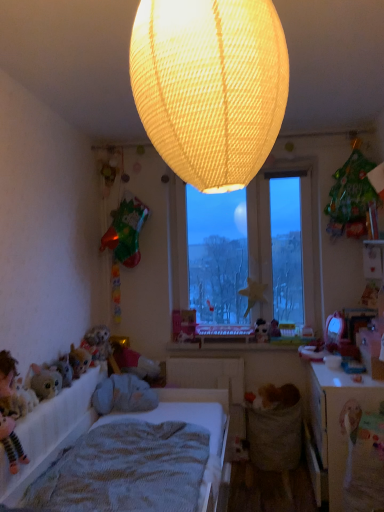
Question: Which direction should I rotate to face matte plastic toy at center, the 1th toy when ordered from bottom to top, — up or down?

Choices:
 (A) up
 (B) down

Answer: (B)

Question: Considering the relative sizes of green matte bag at upper right, which ranks as the second toy in left-to-right order, and matte yellow fabric lampshade at upper center in the image provided, is green matte bag at upper right, which ranks as the second toy in left-to-right order, taller than matte yellow fabric lampshade at upper center?

Choices:
 (A) yes
 (B) no

Answer: (B)

Question: Is green matte bag at upper right, the first toy from the right, positioned before matte yellow fabric lampshade at upper center?

Choices:
 (A) no
 (B) yes

Answer: (A)

Question: Can you confirm if green matte bag at upper right, the first toy from the right, is bigger than matte yellow fabric lampshade at upper center?

Choices:
 (A) yes
 (B) no

Answer: (B)

Question: Considering the relative sizes of green matte bag at upper right, the first toy from the right, and matte yellow fabric lampshade at upper center in the image provided, is green matte bag at upper right, the first toy from the right, shorter than matte yellow fabric lampshade at upper center?

Choices:
 (A) no
 (B) yes

Answer: (B)

Question: Is green matte bag at upper right, which ranks as the second toy in left-to-right order, located outside matte yellow fabric lampshade at upper center?

Choices:
 (A) no
 (B) yes

Answer: (B)

Question: Is green matte bag at upper right, which ranks as the second toy in left-to-right order, beside matte yellow fabric lampshade at upper center?

Choices:
 (A) no
 (B) yes

Answer: (A)

Question: Does gray plush toy at lower left have a smaller size compared to transparent glass window at center?

Choices:
 (A) yes
 (B) no

Answer: (A)

Question: Is the position of gray plush toy at lower left more distant than that of transparent glass window at center?

Choices:
 (A) no
 (B) yes

Answer: (A)

Question: From the image's perspective, is gray plush toy at lower left on top of transparent glass window at center?

Choices:
 (A) no
 (B) yes

Answer: (A)

Question: Considering the relative sizes of gray plush toy at lower left and transparent glass window at center in the image provided, is gray plush toy at lower left wider than transparent glass window at center?

Choices:
 (A) yes
 (B) no

Answer: (A)

Question: Considering the relative sizes of gray plush toy at lower left and transparent glass window at center in the image provided, is gray plush toy at lower left thinner than transparent glass window at center?

Choices:
 (A) no
 (B) yes

Answer: (A)

Question: Is gray plush toy at lower left bigger than transparent glass window at center?

Choices:
 (A) no
 (B) yes

Answer: (A)

Question: From a real-world perspective, is white fabric bed at lower left over wooden table at lower right?

Choices:
 (A) no
 (B) yes

Answer: (B)